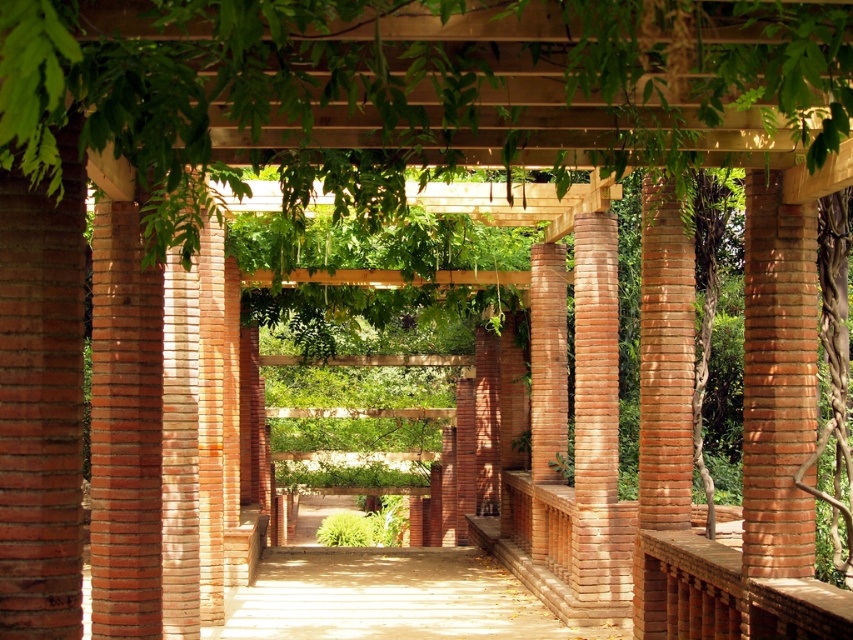
Question: Is sandy brown brick column at left thinner than red brick column at right?

Choices:
 (A) yes
 (B) no

Answer: (B)

Question: Which of the following is the closest to the observer?

Choices:
 (A) red brick column at right
 (B) sandy brown brick column at left

Answer: (A)

Question: Which point is farther to the camera?

Choices:
 (A) red brick column at right
 (B) sandy brown brick column at left

Answer: (B)

Question: Which point is closer to the camera?

Choices:
 (A) sandy brown brick column at left
 (B) red brick column at right

Answer: (B)

Question: In this image, where is sandy brown brick column at left located relative to red brick column at right?

Choices:
 (A) above
 (B) below

Answer: (B)

Question: Considering the relative positions of sandy brown brick column at left and red brick column at right in the image provided, where is sandy brown brick column at left located with respect to red brick column at right?

Choices:
 (A) left
 (B) right

Answer: (A)